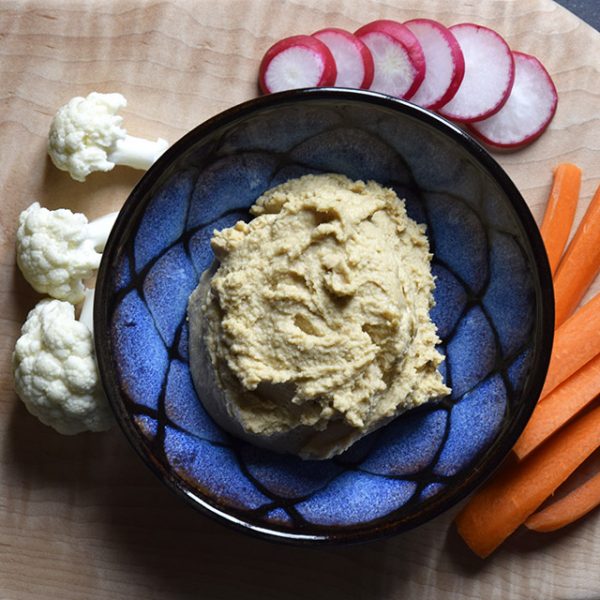
Identify the location of table. The image size is (600, 600). (96, 562), (520, 583), (203, 76), (567, 60).